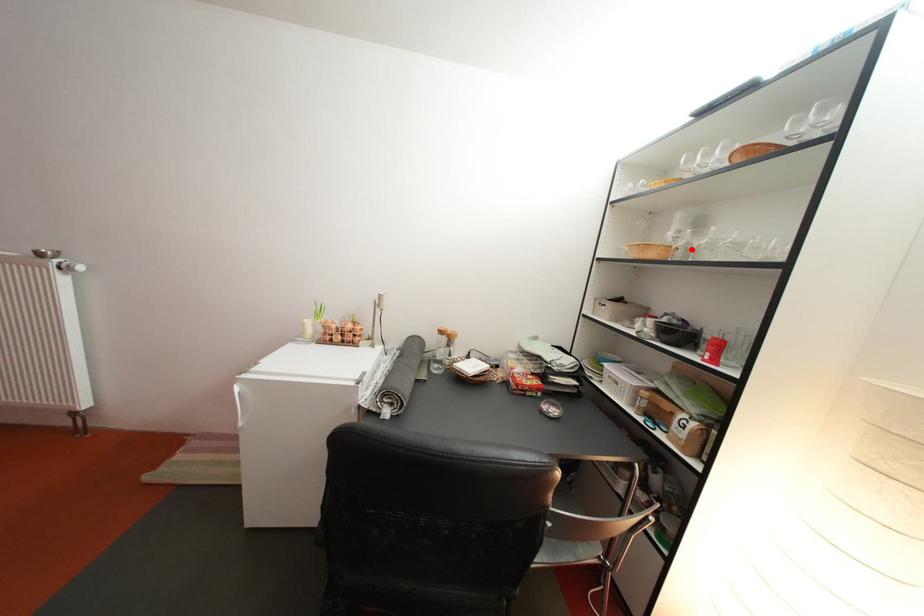
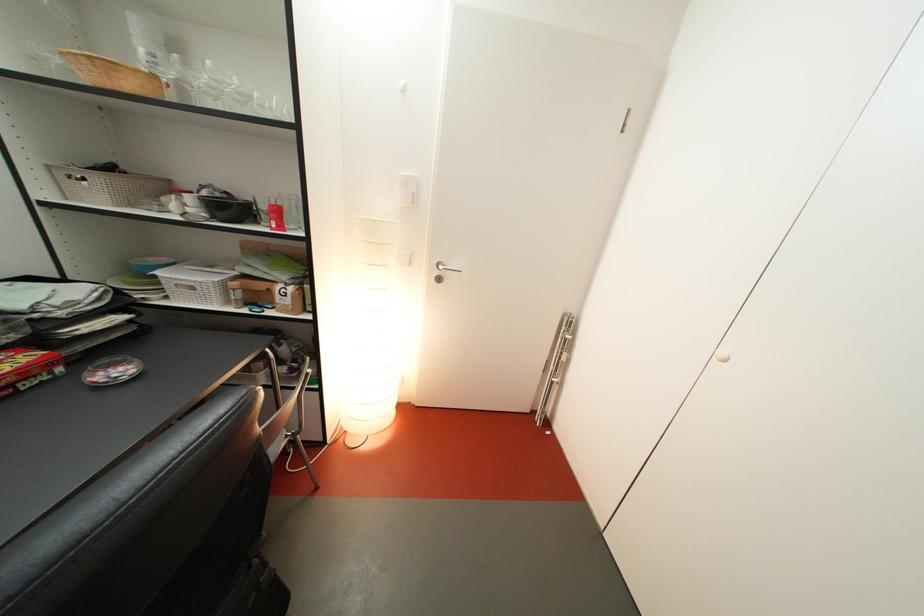
Locate, in the second image, the point that corresponds to the highlighted location in the first image.

(179, 82)